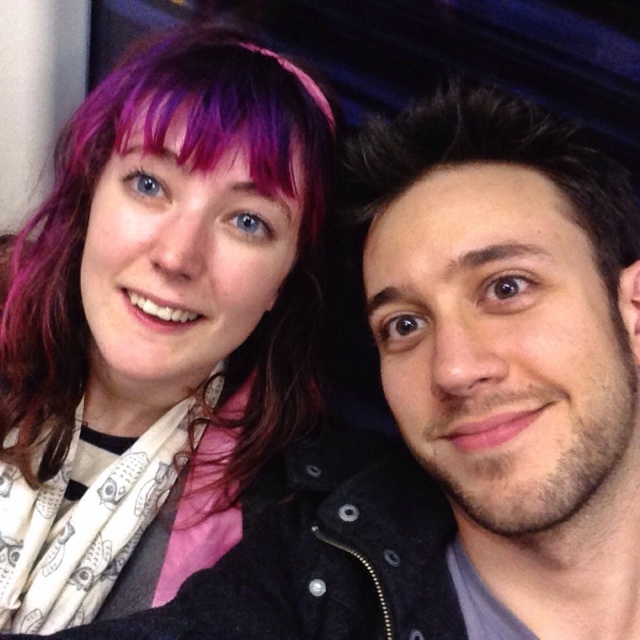
Does matte black jacket at upper left have a lesser width compared to smooth black jacket at right?

Incorrect, matte black jacket at upper left's width is not less than smooth black jacket at right's.

Is the position of matte black jacket at upper left less distant than that of smooth black jacket at right?

No, matte black jacket at upper left is further to the viewer.

Does point (76, 614) come farther from viewer compared to point (419, 122)?

That is True.

This screenshot has width=640, height=640. In order to click on matte black jacket at upper left in this screenshot , I will do `click(156, 321)`.